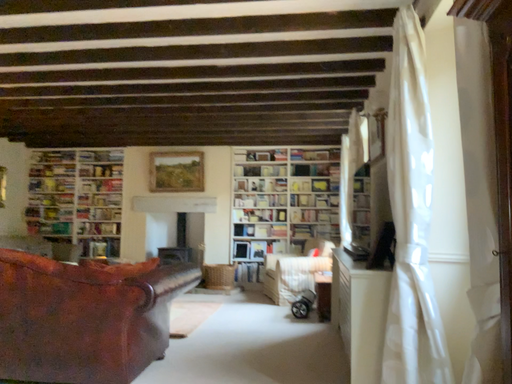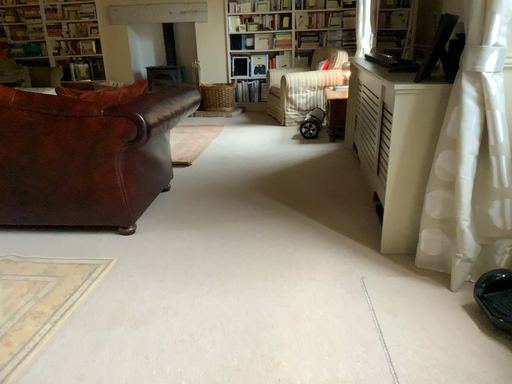
Question: How did the camera likely rotate when shooting the video?

Choices:
 (A) rotated upward
 (B) rotated downward

Answer: (B)